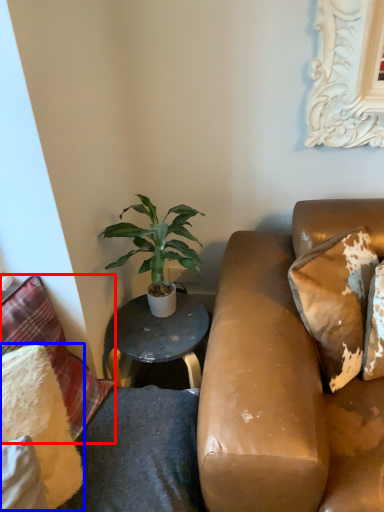
Question: Among these objects, which one is nearest to the camera, pillow (highlighted by a red box) or pillow (highlighted by a blue box)?

Choices:
 (A) pillow
 (B) pillow

Answer: (B)